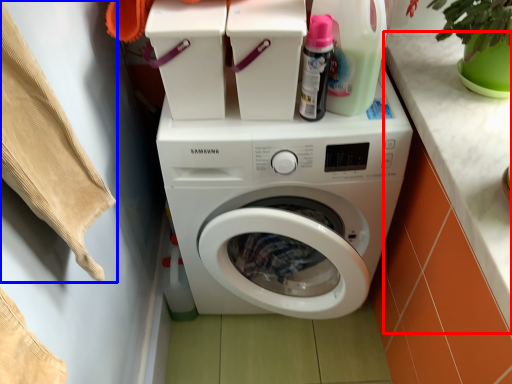
Question: Which point is closer to the camera, counter top (highlighted by a red box) or clothing (highlighted by a blue box)?

Choices:
 (A) counter top
 (B) clothing

Answer: (B)